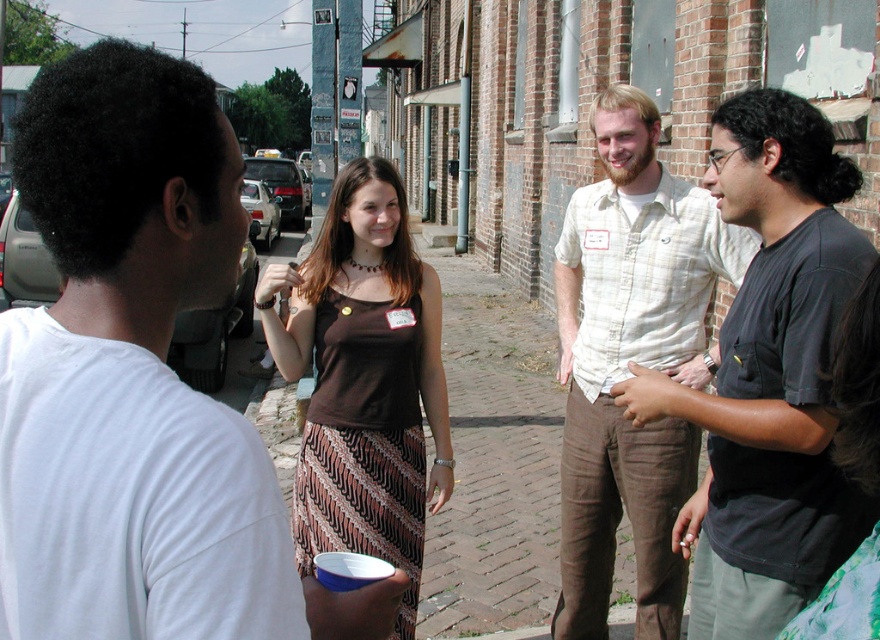
Consider the image. You are a photographer trying to capture a photo of the group. You want to ensure that the light beige plaid shirt at center and the brown fabric dress at center are both visible in the frame. Based on their positions, which one should you position closer to the left side of the camera to include both in the photo?

The light beige plaid shirt at center is to the right of the brown fabric dress at center, so to include both in the photo, you should position the brown fabric dress at center closer to the left side of the camera so that the light beige plaid shirt at center naturally falls to its right within the frame.

You are standing in the scene and want to place a small flowerpot between the two points, point (683, 426) and point (290, 371). Which point should the flowerpot be closer to in order to be placed at the same depth as the closer point?

The flowerpot should be placed closer to point (683, 426) because it is closer to the viewer than point (290, 371).